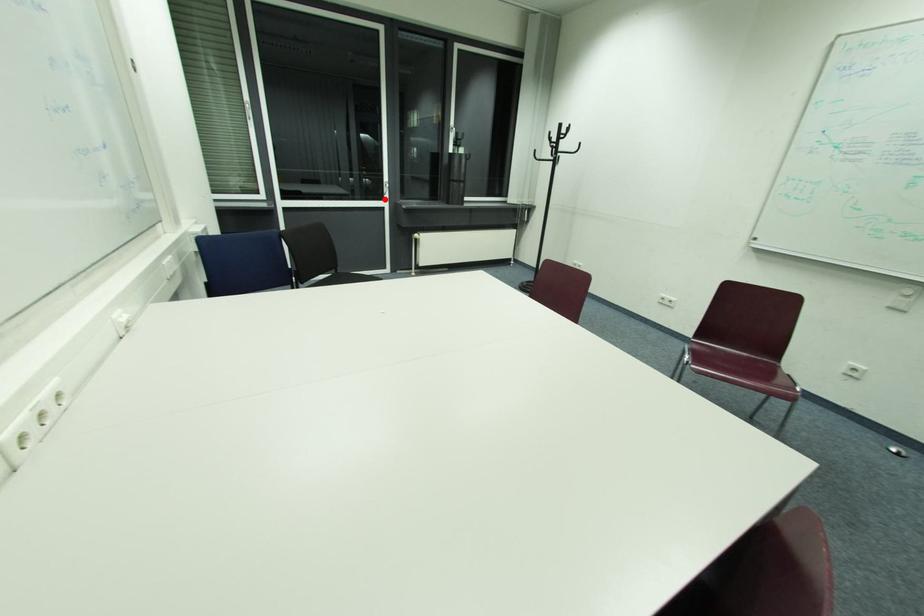
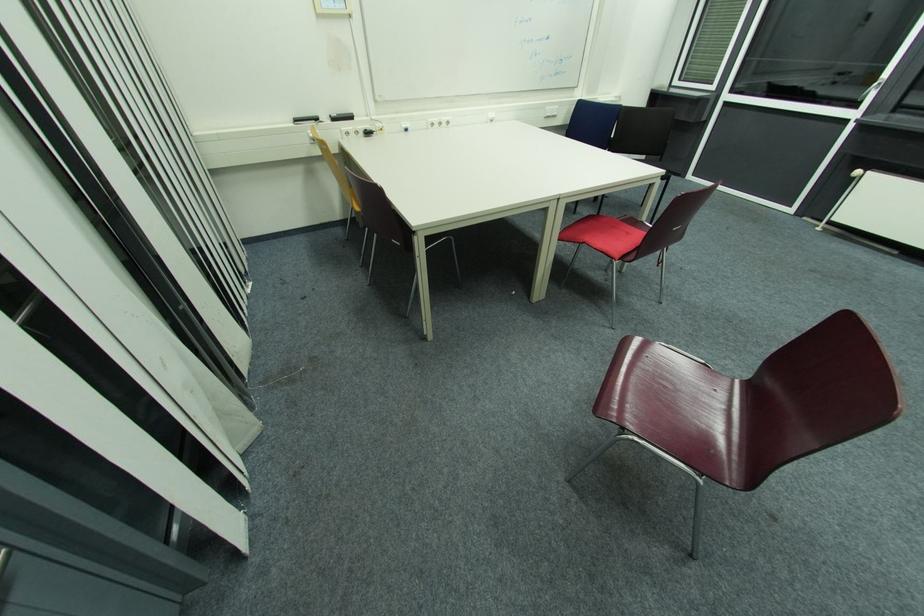
Question: I am providing you with two images of the same scene from different viewpoints. In image1, a red point is highlighted. Considering the same 3D point in image2, which of the following is correct?

Choices:
 (A) It is closer
 (B) It is farther

Answer: (B)